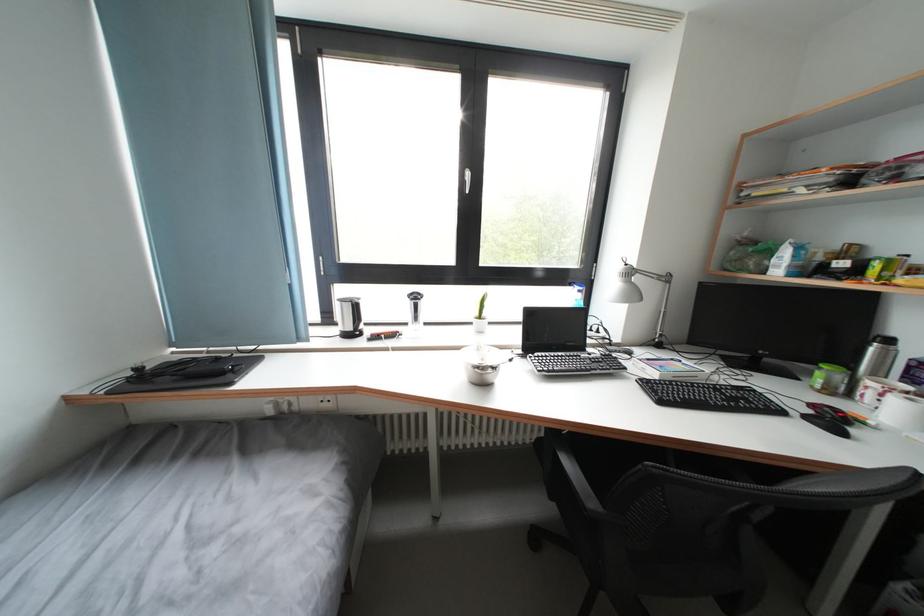
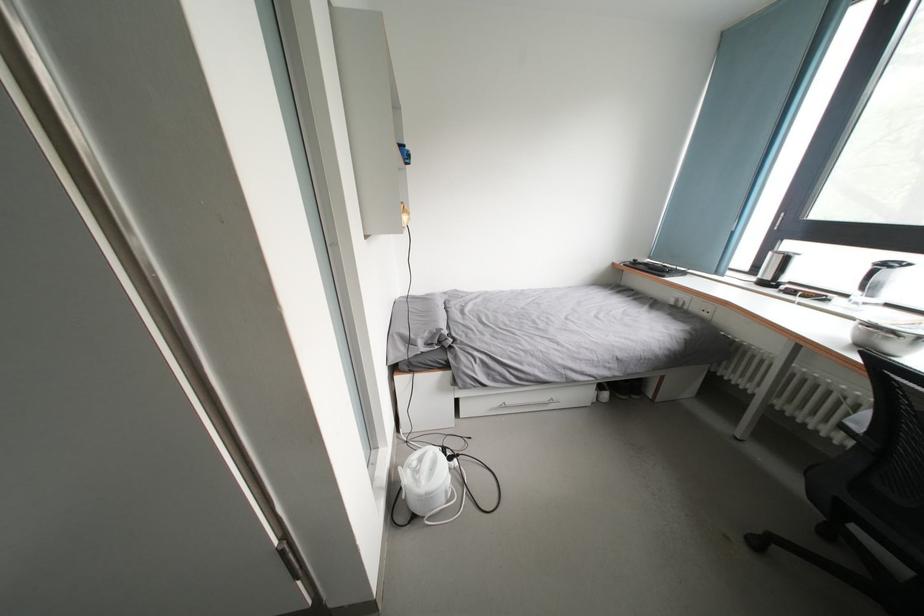
Question: I am providing you with two images of the same scene from different viewpoints. After the viewpoint changes to image2, which objects are now occluded?

Choices:
 (A) white drawer handle
 (B) metal mixing bowl
 (C) silver electric kettle
 (D) none of these

Answer: (D)